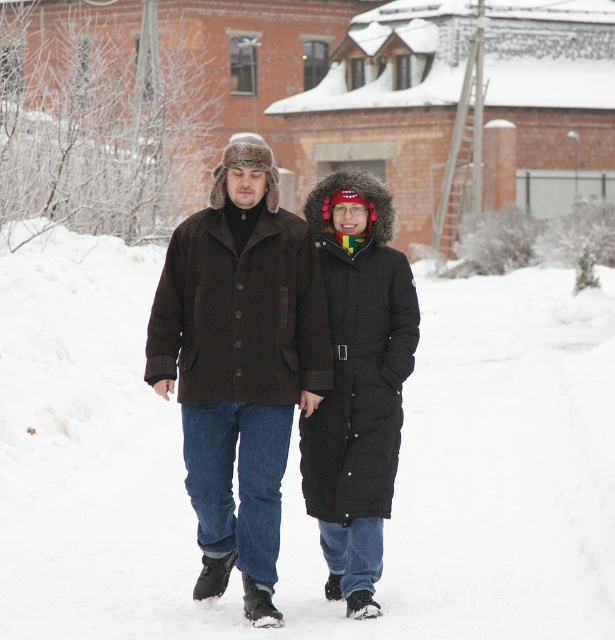
Question: Observing the image, what is the correct spatial positioning of white fluffy snow at center in reference to black down jacket at center?

Choices:
 (A) above
 (B) below

Answer: (A)

Question: Is dark brown wool coat at center wider than black down jacket at center?

Choices:
 (A) no
 (B) yes

Answer: (A)

Question: Among these points, which one is farthest from the camera?

Choices:
 (A) (541, 563)
 (B) (317, 442)

Answer: (A)

Question: Which object is positioned closest to the dark brown wool coat at center?

Choices:
 (A) black down jacket at center
 (B) white fluffy snow at center

Answer: (A)

Question: Which is nearer to the dark brown wool coat at center?

Choices:
 (A) black down jacket at center
 (B) white fluffy snow at center

Answer: (A)

Question: Is white fluffy snow at center above black down jacket at center?

Choices:
 (A) no
 (B) yes

Answer: (B)